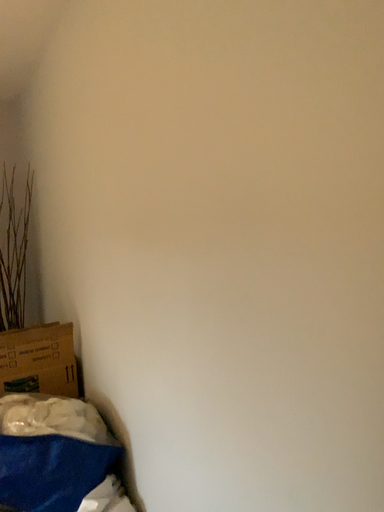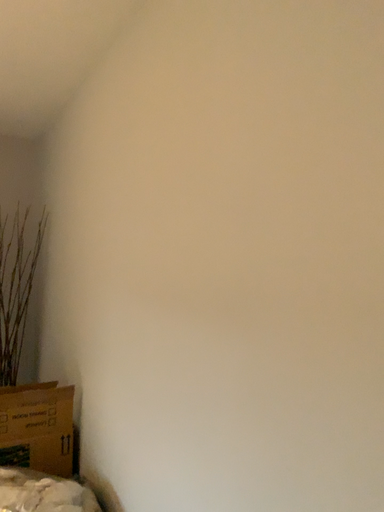
Question: How did the camera likely rotate when shooting the video?

Choices:
 (A) rotated downward
 (B) rotated upward

Answer: (B)